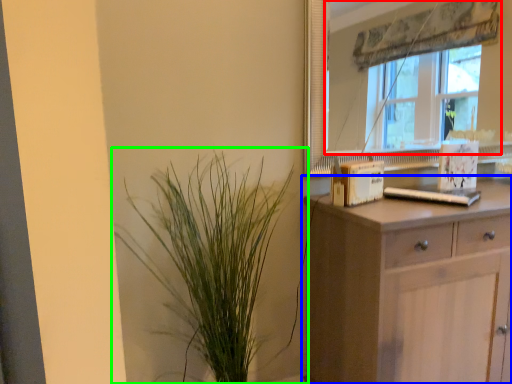
Question: Which object is the closest to the window (highlighted by a red box)? Choose among these: chest of drawers (highlighted by a blue box) or houseplant (highlighted by a green box).

Choices:
 (A) chest of drawers
 (B) houseplant

Answer: (A)